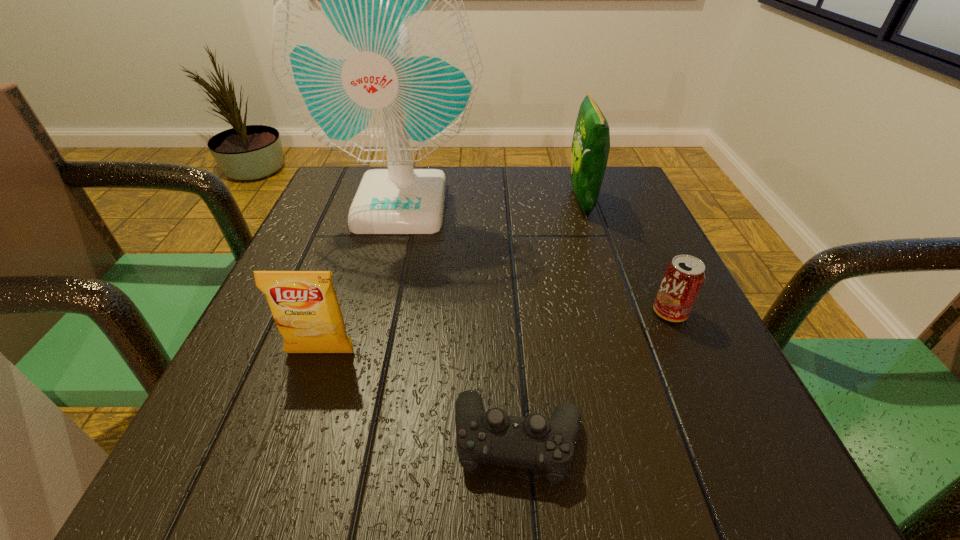
Image resolution: width=960 pixels, height=540 pixels. What are the coordinates of `crisp (potato chip) that is at the left edge` in the screenshot? It's located at (304, 305).

I want to click on crisp (potato chip) that is at the right edge, so click(591, 141).

You are a GUI agent. You are given a task and a screenshot of the screen. Output one action in this format:
    pyautogui.click(x=<x>, y=<y>)
    Task: Click on the soda can located at the right edge
    The image size is (960, 540).
    Given the screenshot: What is the action you would take?
    pyautogui.click(x=684, y=276)

Where is `object located in the far left corner section of the desktop`? The height and width of the screenshot is (540, 960). object located in the far left corner section of the desktop is located at coordinates (372, 49).

The height and width of the screenshot is (540, 960). In order to click on object that is at the far right corner in this screenshot , I will do `click(591, 141)`.

Where is `vacant region at the near edge of the desktop`? The width and height of the screenshot is (960, 540). vacant region at the near edge of the desktop is located at coordinates (347, 439).

Find the location of a particular element. vacant space at the left edge of the desktop is located at coordinates (317, 239).

The image size is (960, 540). Identify the location of vacant area at the right edge. (648, 280).

This screenshot has height=540, width=960. In order to click on vacant area at the far left corner of the desktop in this screenshot , I will do `click(336, 195)`.

Identify the location of free spot at the near left corner of the desktop. The width and height of the screenshot is (960, 540). (300, 497).